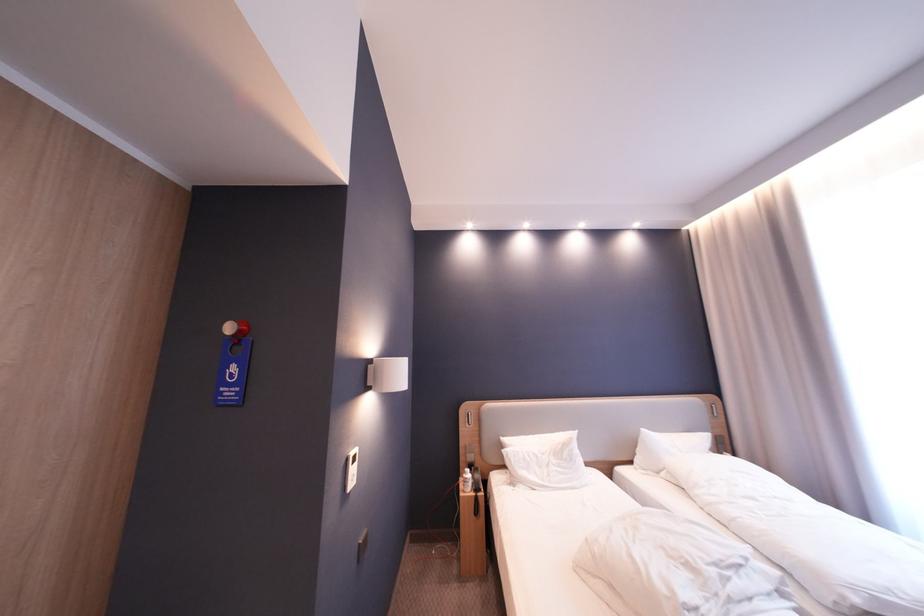
The image size is (924, 616). What do you see at coordinates (236, 330) in the screenshot?
I see `the red wall hook` at bounding box center [236, 330].